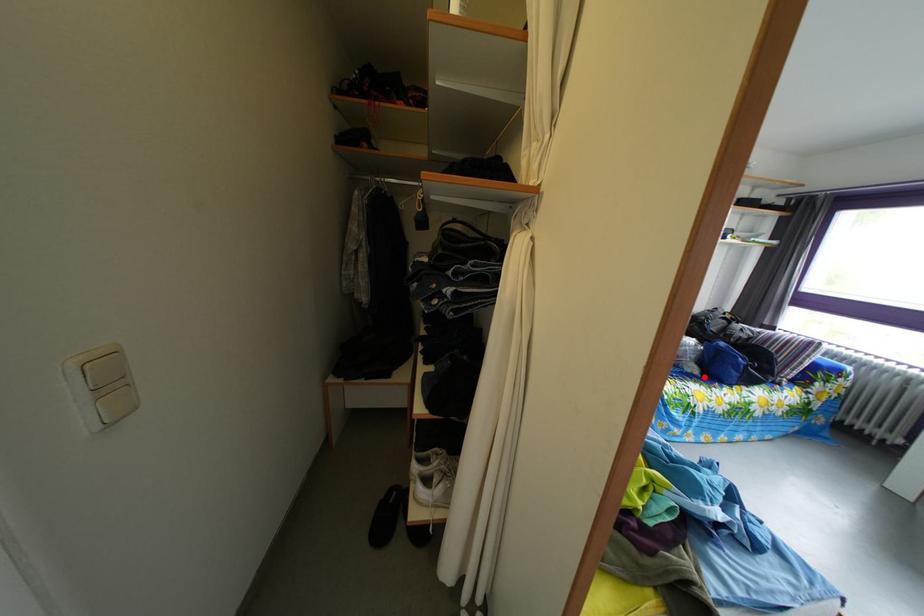
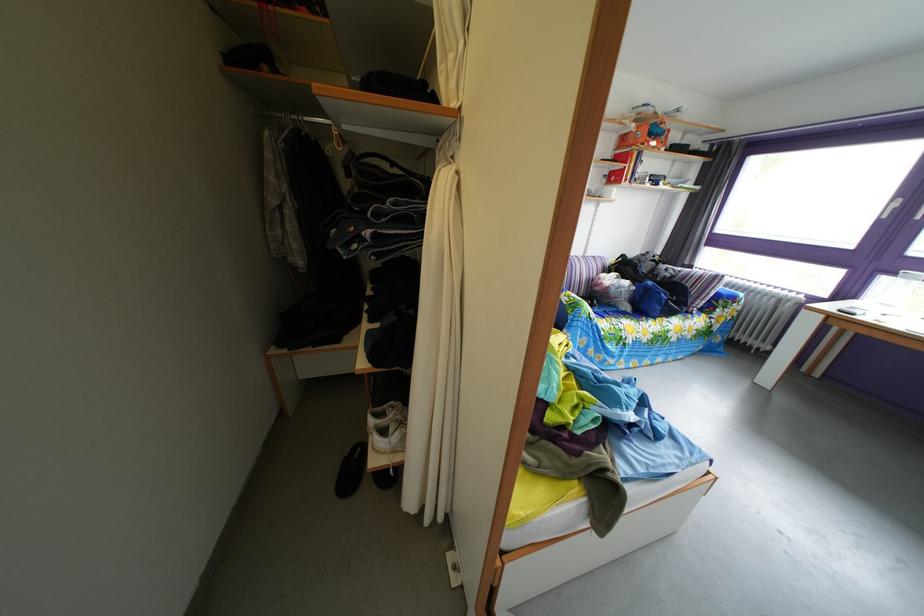
In the second image, find the point that corresponds to the highlighted location in the first image.

(638, 315)